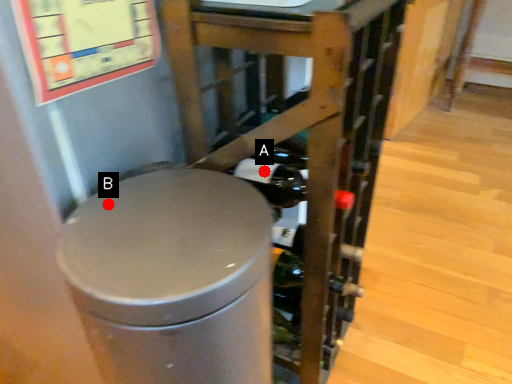
Question: Two points are circled on the image, labeled by A and B beside each circle. Which point is farther from the camera taking this photo?

Choices:
 (A) A is further
 (B) B is further

Answer: (A)